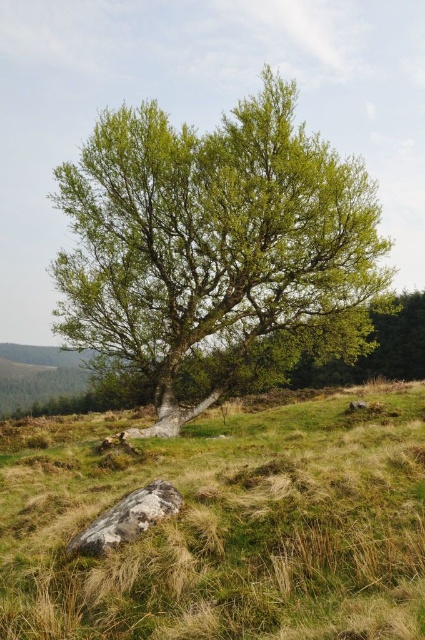
You are a gardener who needs to water the green grass at lower center and the gray rough rock at lower center. Your watering can has a range of 6 feet. Can you water both from your current position without moving?

The green grass at lower center is 7.04 feet away from the gray rough rock at lower center. Since your watering can only reaches 6 feet, you cannot water both from the same position without moving.

From the picture: You are a gardener planning to plant a new flower bed between the green leafy tree at center and the gray rough rock at lower center. Considering their sizes, which object should you place the flowers closer to to ensure they have enough space to grow?

The green leafy tree at center is bigger than the gray rough rock at lower center, so you should place the flowers closer to the gray rough rock at lower center to allow sufficient space for growth.

You are a gardener planning to plant a new flower bed between the green grass at lower center and the green leafy tree at center. Considering their sizes, which area would you choose to place the flowers so they have enough space to grow?

The green leafy tree at center occupies more space than the green grass at lower center, so you should choose the area near the green leafy tree at center for the flower bed to ensure there is enough space for the flowers to grow.